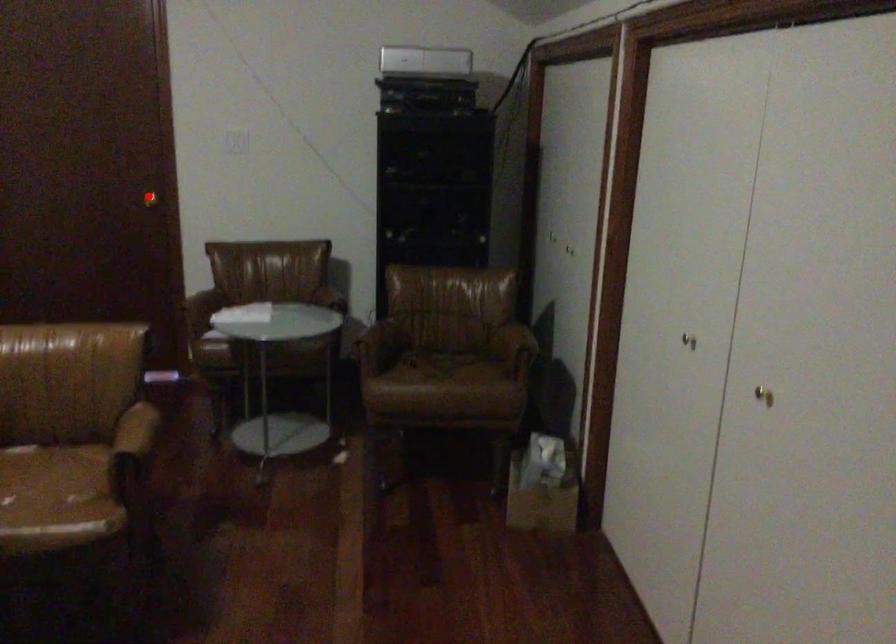
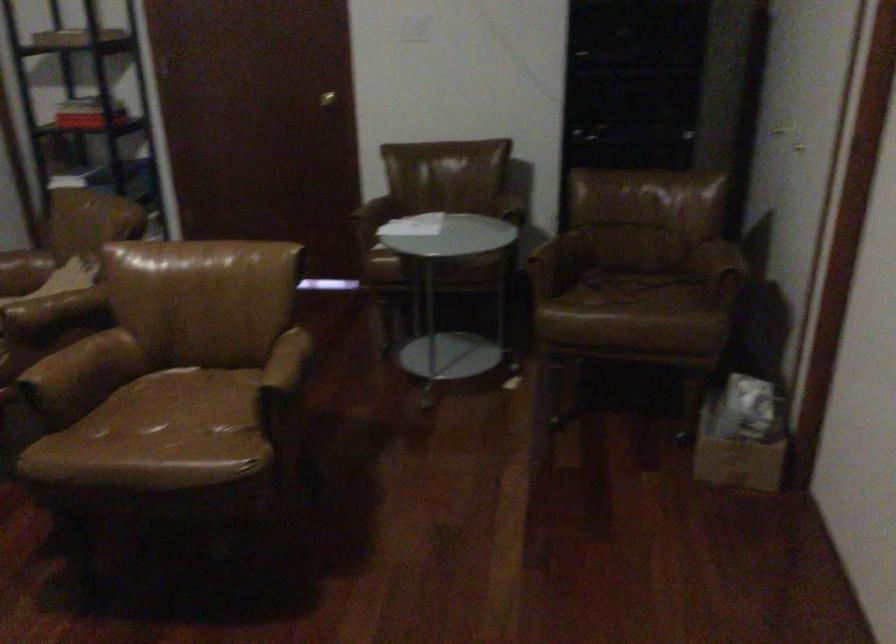
Find the pixel in the second image that matches the highlighted location in the first image.

(326, 99)